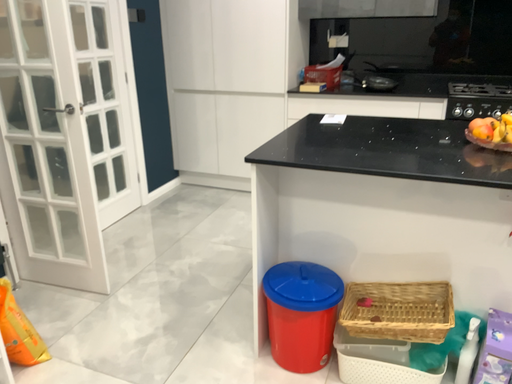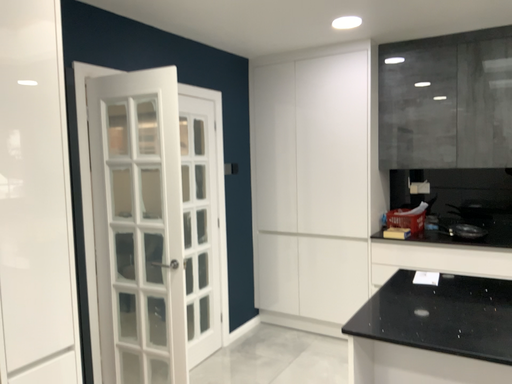
Question: Which way did the camera rotate in the video?

Choices:
 (A) rotated downward
 (B) rotated upward

Answer: (B)